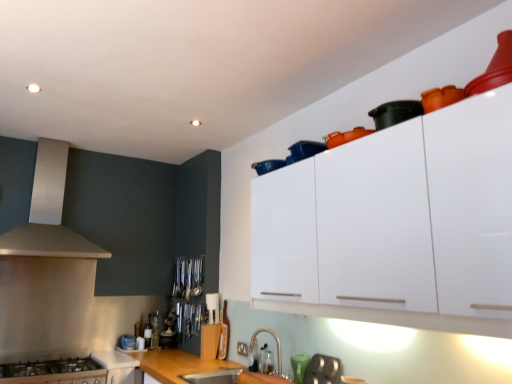
Where is `free space underneath metallic silver utensils at center, which appears as the 3th appliance when viewed from the top (from a real-world perspective)`? Image resolution: width=512 pixels, height=384 pixels. free space underneath metallic silver utensils at center, which appears as the 3th appliance when viewed from the top (from a real-world perspective) is located at coordinates tap(181, 293).